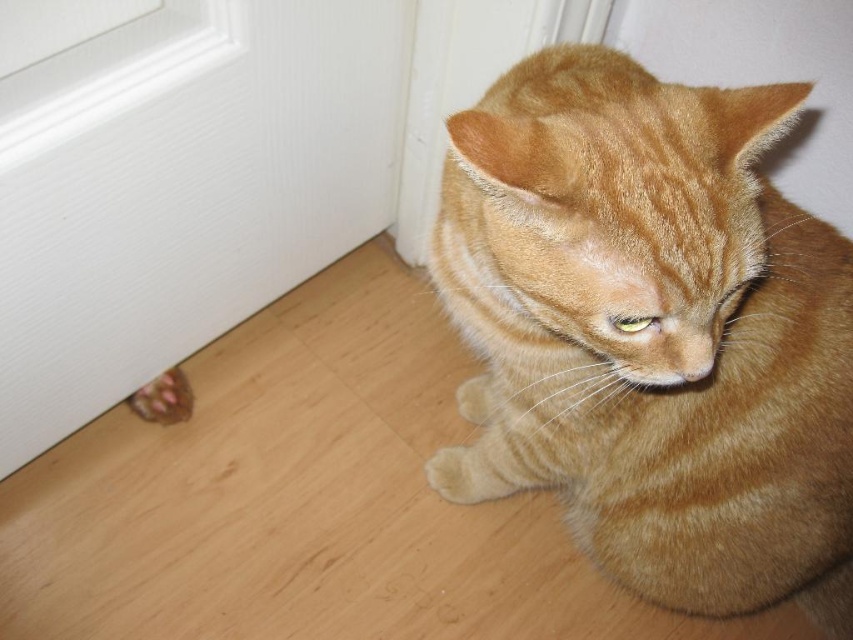
Is orange tabby cat at lower right bigger than brown textured paw at lower left?

Yes.

Does point (630, 492) come farther from viewer compared to point (154, 404)?

No, (630, 492) is closer to viewer.

Locate an element on the screen. This screenshot has height=640, width=853. orange tabby cat at lower right is located at coordinates (653, 332).

Who is more forward, (772,500) or (99,346)?

Positioned in front is point (772,500).

Identify the location of orange tabby cat at lower right. (653, 332).

Does point (599, 81) lie in front of point (329, 196)?

Yes.

Locate an element on the screen. orange tabby cat at lower right is located at coordinates (653, 332).

Is point (212, 211) positioned behind point (187, 388)?

No, it is not.

The image size is (853, 640). Find the location of `white textured door at lower left`. white textured door at lower left is located at coordinates (183, 188).

You are a GUI agent. You are given a task and a screenshot of the screen. Output one action in this format:
    pyautogui.click(x=<x>, y=<y>)
    Task: Click on the white textured door at lower left
    The height and width of the screenshot is (640, 853).
    Given the screenshot: What is the action you would take?
    pyautogui.click(x=183, y=188)